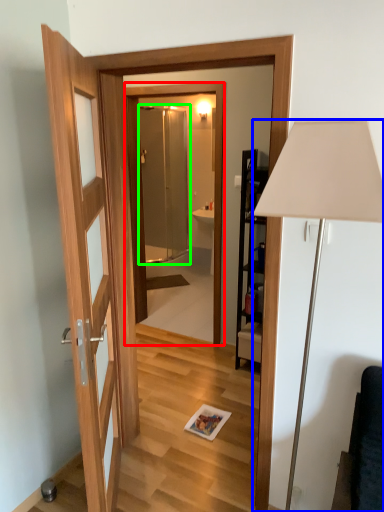
Question: Which object is positioned closest to mirror (highlighted by a red box)? Select from lamp (highlighted by a blue box) and screen door (highlighted by a green box).

Choices:
 (A) lamp
 (B) screen door

Answer: (B)